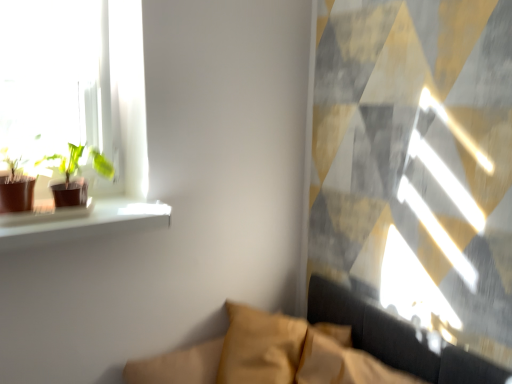
Identify the location of green matte plant at left, the 1th houseplant viewed from the right. This screenshot has width=512, height=384. (68, 178).

Would you consider green matte plant at left, the 2th houseplant from the left, to be distant from velvet mustard couch at lower center?

That's not correct — green matte plant at left, the 2th houseplant from the left, is a little close to velvet mustard couch at lower center.

Considering the positions of points (70, 149) and (163, 363), is point (70, 149) closer to camera compared to point (163, 363)?

Yes.

Is the position of green matte plant at left, the 2th houseplant from the left, less distant than that of velvet mustard couch at lower center?

No, it is behind velvet mustard couch at lower center.

Which is behind, point (153, 376) or point (42, 157)?

Positioned behind is point (153, 376).

Between velvet mustard couch at lower center and green matte plant at left, the 2th houseplant from the left, which one has more height?

Standing taller between the two is velvet mustard couch at lower center.

Can you see velvet mustard couch at lower center touching green matte plant at left, the 1th houseplant viewed from the right?

velvet mustard couch at lower center and green matte plant at left, the 1th houseplant viewed from the right, are clearly separated.

From a real-world perspective, is velvet mustard couch at lower center physically located above or below green matte plant at left, the 2th houseplant from the left?

velvet mustard couch at lower center is below green matte plant at left, the 2th houseplant from the left.

Are velvet mustard couch at lower center and matte brown pot at left, which is the 2th houseplant from right to left, far apart?

No, velvet mustard couch at lower center is in close proximity to matte brown pot at left, which is the 2th houseplant from right to left.

Between velvet mustard couch at lower center and matte brown pot at left, the 1th houseplant in the left-to-right sequence, which one is positioned in front?

velvet mustard couch at lower center.

From the image's perspective, is velvet mustard couch at lower center above or below matte brown pot at left, the 1th houseplant in the left-to-right sequence?

Based on their image positions, velvet mustard couch at lower center is located beneath matte brown pot at left, the 1th houseplant in the left-to-right sequence.

This screenshot has height=384, width=512. I want to click on the 2nd houseplant positioned above the velvet mustard couch at lower center (from a real-world perspective), so click(x=16, y=185).

Which object is wider, matte brown pot at left, which is the 2th houseplant from right to left, or green matte plant at left, the 2th houseplant from the left?

With larger width is green matte plant at left, the 2th houseplant from the left.

From the image's perspective, which one is positioned higher, matte brown pot at left, the 1th houseplant in the left-to-right sequence, or green matte plant at left, the 2th houseplant from the left?

green matte plant at left, the 2th houseplant from the left, from the image's perspective.

Considering the relative sizes of matte brown pot at left, which is the 2th houseplant from right to left, and green matte plant at left, the 1th houseplant viewed from the right, in the image provided, is matte brown pot at left, which is the 2th houseplant from right to left, smaller than green matte plant at left, the 1th houseplant viewed from the right,?

Yes.

Is matte brown pot at left, the 1th houseplant in the left-to-right sequence, oriented towards green matte plant at left, the 2th houseplant from the left?

No, matte brown pot at left, the 1th houseplant in the left-to-right sequence, is not facing towards green matte plant at left, the 2th houseplant from the left.

Identify the location of couch lying below the matte brown pot at left, which is the 2th houseplant from right to left (from the image's perspective). (397, 339).

From a real-world perspective, is matte brown pot at left, the 1th houseplant in the left-to-right sequence, physically located above or below velvet mustard couch at lower center?

In terms of real-world spatial position, matte brown pot at left, the 1th houseplant in the left-to-right sequence, is above velvet mustard couch at lower center.

Can you confirm if matte brown pot at left, which is the 2th houseplant from right to left, is shorter than velvet mustard couch at lower center?

Yes.

Is matte brown pot at left, which is the 2th houseplant from right to left, next to velvet mustard couch at lower center?

matte brown pot at left, which is the 2th houseplant from right to left, and velvet mustard couch at lower center are not in contact.

Is green matte plant at left, the 1th houseplant viewed from the right, at the left side of matte brown pot at left, the 1th houseplant in the left-to-right sequence?

Incorrect, green matte plant at left, the 1th houseplant viewed from the right, is not on the left side of matte brown pot at left, the 1th houseplant in the left-to-right sequence.

Is green matte plant at left, the 1th houseplant viewed from the right, touching matte brown pot at left, the 1th houseplant in the left-to-right sequence?

Yes, green matte plant at left, the 1th houseplant viewed from the right, is in contact with matte brown pot at left, the 1th houseplant in the left-to-right sequence.

Find the location of `houseplant that is the 2nd object located above the velvet mustard couch at lower center (from the image's perspective)`. houseplant that is the 2nd object located above the velvet mustard couch at lower center (from the image's perspective) is located at coordinates click(x=68, y=178).

The width and height of the screenshot is (512, 384). What are the coordinates of `couch in front of the green matte plant at left, the 1th houseplant viewed from the right` in the screenshot? It's located at (397, 339).

When comparing their distances from matte brown pot at left, which is the 2th houseplant from right to left, does green matte plant at left, the 1th houseplant viewed from the right, or velvet mustard couch at lower center seem closer?

green matte plant at left, the 1th houseplant viewed from the right.

Considering their positions, is green matte plant at left, the 1th houseplant viewed from the right, positioned further to velvet mustard couch at lower center than matte brown pot at left, the 1th houseplant in the left-to-right sequence?

Based on the image, matte brown pot at left, the 1th houseplant in the left-to-right sequence, appears to be further to velvet mustard couch at lower center.

Based on their spatial positions, is velvet mustard couch at lower center or green matte plant at left, the 2th houseplant from the left, further from matte brown pot at left, the 1th houseplant in the left-to-right sequence?

Among the two, velvet mustard couch at lower center is located further to matte brown pot at left, the 1th houseplant in the left-to-right sequence.

Based on their spatial positions, is matte brown pot at left, which is the 2th houseplant from right to left, or velvet mustard couch at lower center further from green matte plant at left, the 2th houseplant from the left?

velvet mustard couch at lower center is further to green matte plant at left, the 2th houseplant from the left.

Based on their spatial positions, is velvet mustard couch at lower center or matte brown pot at left, the 1th houseplant in the left-to-right sequence, closer to green matte plant at left, the 2th houseplant from the left?

matte brown pot at left, the 1th houseplant in the left-to-right sequence, lies closer to green matte plant at left, the 2th houseplant from the left, than the other object.

From the image, which object appears to be farther from velvet mustard couch at lower center, matte brown pot at left, which is the 2th houseplant from right to left, or green matte plant at left, the 1th houseplant viewed from the right?

Based on the image, matte brown pot at left, which is the 2th houseplant from right to left, appears to be further to velvet mustard couch at lower center.

Where is `houseplant between matte brown pot at left, the 1th houseplant in the left-to-right sequence, and velvet mustard couch at lower center`? houseplant between matte brown pot at left, the 1th houseplant in the left-to-right sequence, and velvet mustard couch at lower center is located at coordinates (68, 178).